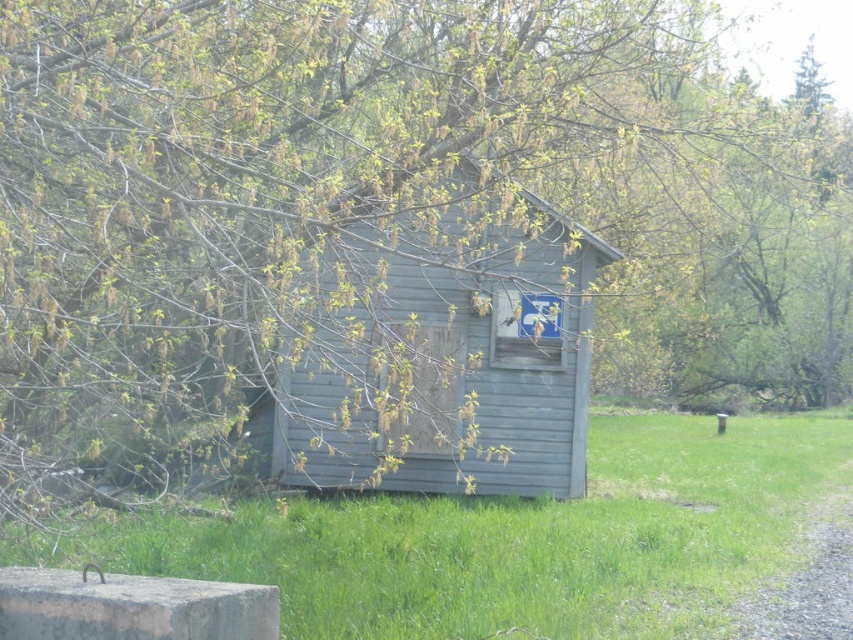
You are standing in a field and want to reach the gray wood hut at center. There is green grass at lower center in your path. Can you walk directly to the hut without stepping on the grass?

The green grass at lower center is further to the viewer than the gray wood hut at center, so the grass is between you and the hut. Therefore, you would have to step on the grass to reach the hut.

You are standing in the grassy area near the shed and want to place a small garden gnome between the green grass at lower center and the gray wood hut at center. Based on their heights, which object will the gnome be taller than?

The green grass at lower center has a lesser height compared to the gray wood hut at center. Since the gnome is small, it will be taller than the green grass at lower center but shorter than the gray wood hut at center.